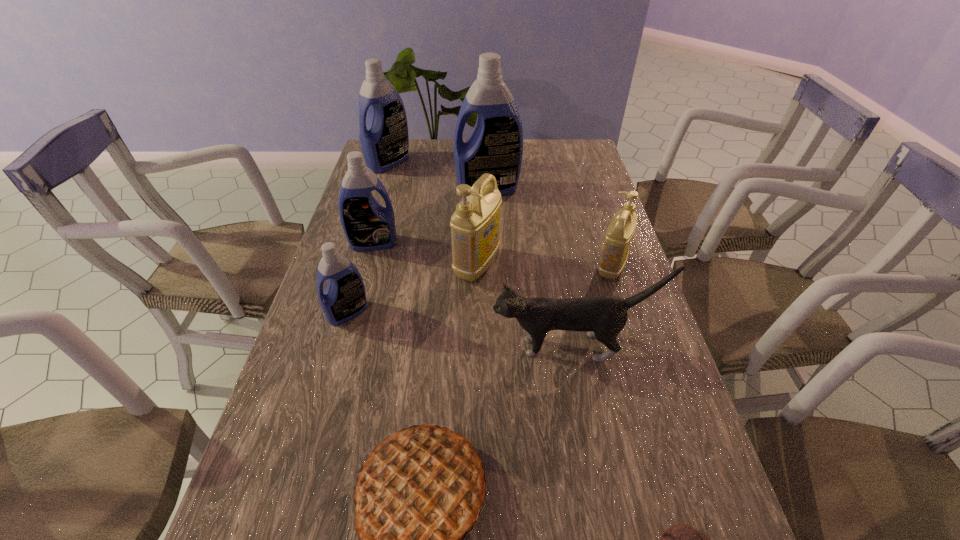
Where is `the rightmost blue detergent`? The image size is (960, 540). the rightmost blue detergent is located at coordinates (495, 146).

You are a GUI agent. You are given a task and a screenshot of the screen. Output one action in this format:
    pyautogui.click(x=<x>, y=<y>)
    Task: Click on the biggest blue detergent
    Image resolution: width=960 pixels, height=540 pixels.
    Given the screenshot: What is the action you would take?
    pyautogui.click(x=495, y=146)

Locate an element on the screen. The image size is (960, 540). the farthest detergent is located at coordinates (384, 140).

You are a GUI agent. You are given a task and a screenshot of the screen. Output one action in this format:
    pyautogui.click(x=<x>, y=<y>)
    Task: Click on the farthest object
    The height and width of the screenshot is (540, 960).
    Given the screenshot: What is the action you would take?
    pyautogui.click(x=384, y=140)

The width and height of the screenshot is (960, 540). I want to click on the left beige detergent, so click(x=475, y=225).

I want to click on the third farthest blue detergent, so click(367, 225).

Find the location of a particular element. Image resolution: width=960 pixels, height=540 pixels. the third nearest object is located at coordinates (604, 317).

Where is `the rightmost detergent`? The width and height of the screenshot is (960, 540). the rightmost detergent is located at coordinates (618, 237).

Locate an element on the screen. the smaller beige detergent is located at coordinates (618, 237).

At what (x,y) coordinates should I click in order to perform the action: click on the nearest detergent. Please return your answer as a coordinate pair (x, y). The image size is (960, 540). Looking at the image, I should click on (344, 297).